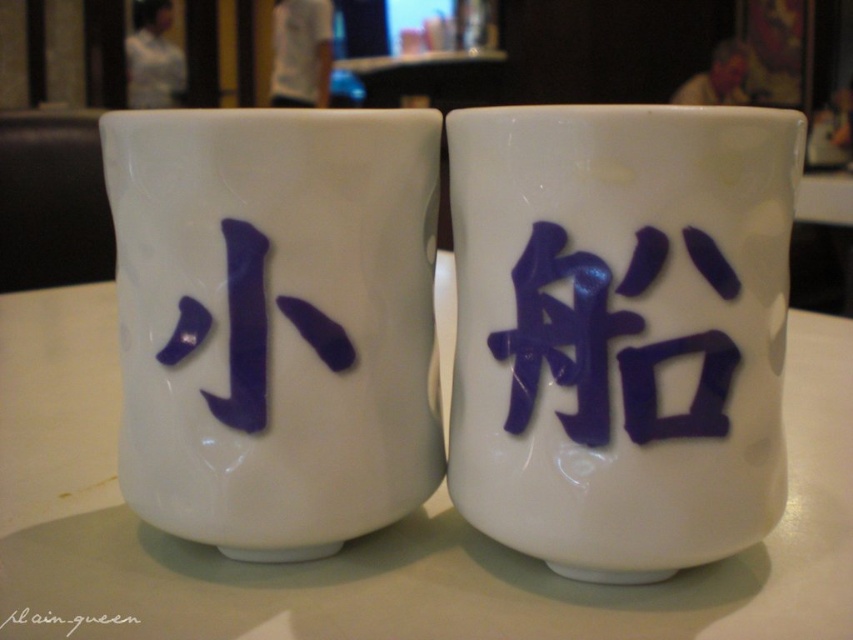
Question: Which point is closer to the camera?

Choices:
 (A) (207, 348)
 (B) (653, 449)

Answer: (B)

Question: Where is glossy ceramic mug at upper center located in relation to matte white mug at center in the image?

Choices:
 (A) above
 (B) below

Answer: (B)

Question: Is purple glossy chinese character at right to the left of black ink signature at center from the viewer's perspective?

Choices:
 (A) yes
 (B) no

Answer: (B)

Question: Which point is farther from the camera taking this photo?

Choices:
 (A) (755, 636)
 (B) (79, 624)

Answer: (B)

Question: Can you confirm if purple glossy chinese character at right is positioned below black ink signature at center?

Choices:
 (A) yes
 (B) no

Answer: (B)

Question: Which point appears farthest from the camera in this image?

Choices:
 (A) (535, 317)
 (B) (426, 481)
 (C) (840, 378)
 (D) (22, 605)

Answer: (C)